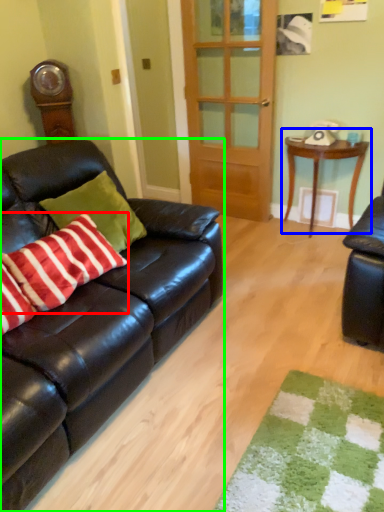
Question: Which is farther away from pillow (highlighted by a red box)? table (highlighted by a blue box) or studio couch (highlighted by a green box)?

Choices:
 (A) table
 (B) studio couch

Answer: (A)